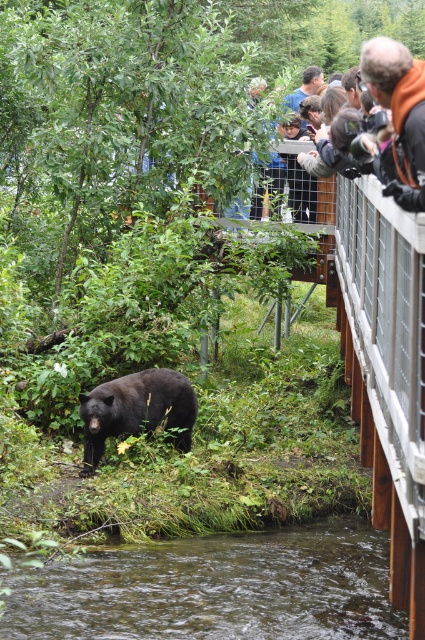
Who is taller, black furry bear at lower left or orange jacket at upper right?

black furry bear at lower left

Between point (102, 433) and point (421, 166), which one is positioned in front?

Point (421, 166) is more forward.

The height and width of the screenshot is (640, 425). Describe the element at coordinates (136, 410) in the screenshot. I see `black furry bear at lower left` at that location.

You are a GUI agent. You are given a task and a screenshot of the screen. Output one action in this format:
    pyautogui.click(x=<x>, y=<y>)
    Task: Click on the black furry bear at lower left
    
    Given the screenshot: What is the action you would take?
    pyautogui.click(x=136, y=410)

Is point (399, 614) closer to camera compared to point (178, 442)?

Yes, point (399, 614) is in front of point (178, 442).

Locate an element on the screen. Image resolution: width=425 pixels, height=640 pixels. clear water at lower center is located at coordinates (215, 588).

The width and height of the screenshot is (425, 640). Identify the location of clear water at lower center. (215, 588).

Between clear water at lower center and orange jacket at upper right, which one appears on the left side from the viewer's perspective?

clear water at lower center is more to the left.

Locate an element on the screen. Image resolution: width=425 pixels, height=640 pixels. clear water at lower center is located at coordinates (215, 588).

Where is `clear water at lower center`? The height and width of the screenshot is (640, 425). clear water at lower center is located at coordinates click(215, 588).